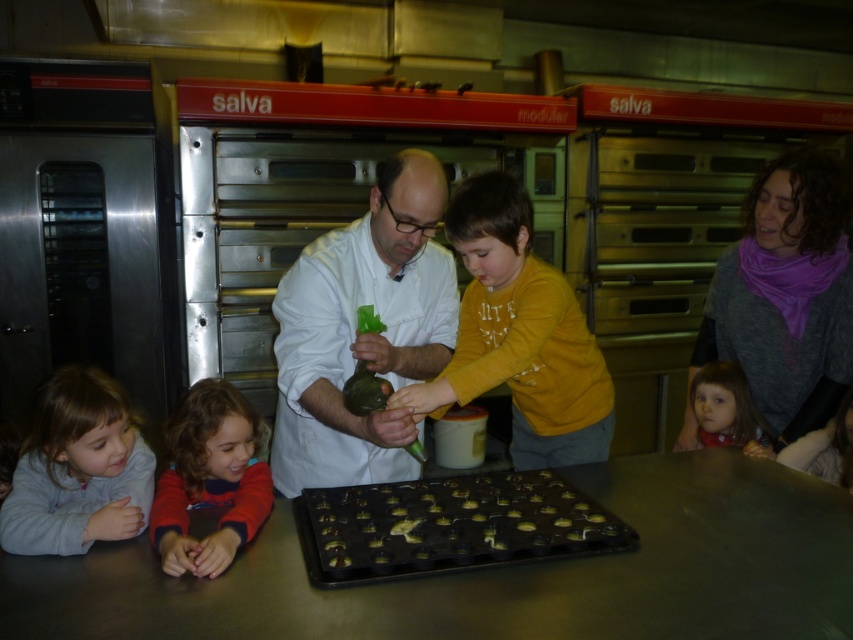
Who is lower down, purple scarf at upper right or golden chocolate tray at center?

golden chocolate tray at center is below.

Does purple scarf at upper right appear on the left side of golden chocolate tray at center?

No, purple scarf at upper right is not to the left of golden chocolate tray at center.

Locate an element on the screen. purple scarf at upper right is located at coordinates (787, 292).

Which of these two, gray fleece jacket at lower left or matte pink scarf at lower right, stands taller?

Standing taller between the two is gray fleece jacket at lower left.

Who is positioned more to the left, gray fleece jacket at lower left or matte pink scarf at lower right?

Positioned to the left is gray fleece jacket at lower left.

Find the location of `gray fleece jacket at lower left`. gray fleece jacket at lower left is located at coordinates (78, 468).

I want to click on gray fleece jacket at lower left, so click(78, 468).

Between yellow matte shirt at center and curly-haired child at lower left, which one appears on the right side from the viewer's perspective?

yellow matte shirt at center is more to the right.

Consider the image. Can you confirm if yellow matte shirt at center is smaller than curly-haired child at lower left?

Incorrect, yellow matte shirt at center is not smaller in size than curly-haired child at lower left.

Which is in front, point (573, 444) or point (215, 497)?

Positioned in front is point (215, 497).

This screenshot has height=640, width=853. Identify the location of yellow matte shirt at center. (519, 333).